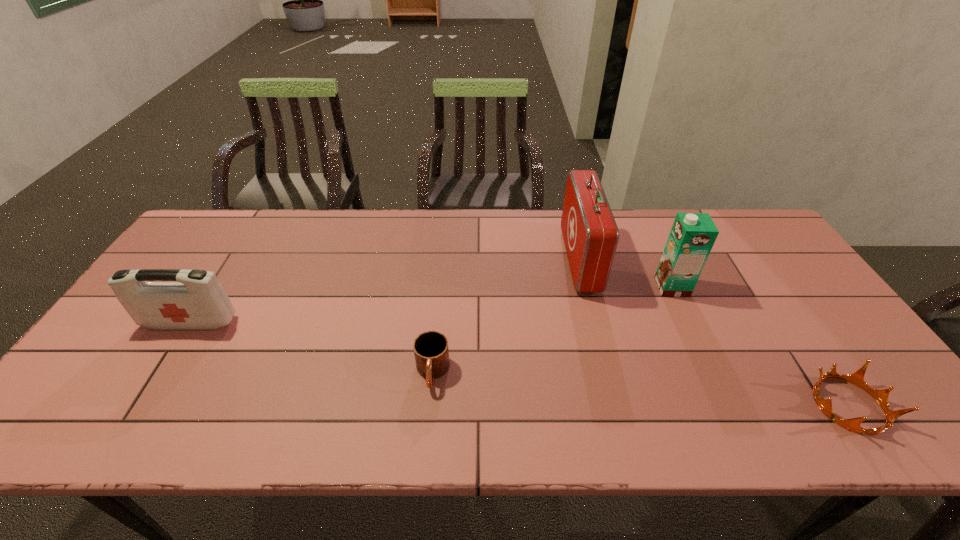
You are a GUI agent. You are given a task and a screenshot of the screen. Output one action in this format:
    pyautogui.click(x=<x>, y=<y>)
    Task: Click on the blank space at the near edge of the desktop
    
    Given the screenshot: What is the action you would take?
    pyautogui.click(x=498, y=415)

Image resolution: width=960 pixels, height=540 pixels. I want to click on vacant space at the right edge of the desktop, so click(x=735, y=261).

What are the coordinates of `free space at the far right corner` in the screenshot? It's located at (765, 241).

Identify the location of vacant region at the near right corner of the desktop. This screenshot has width=960, height=540. (856, 441).

Locate an element on the screen. vacant space that's between the mug and the right first-aid kit is located at coordinates (506, 316).

This screenshot has width=960, height=540. Identify the location of free space between the right first-aid kit and the mug. (506, 316).

You are a GUI agent. You are given a task and a screenshot of the screen. Output one action in this format:
    pyautogui.click(x=<x>, y=<y>)
    Task: Click on the free space between the third object from right to left and the second object from right to left
    This screenshot has height=540, width=960.
    Given the screenshot: What is the action you would take?
    pyautogui.click(x=626, y=273)

At what (x,y) coordinates should I click in order to perform the action: click on blank region between the rightmost object and the second object from right to left. Please return your answer as a coordinate pair (x, y). The width and height of the screenshot is (960, 540). Looking at the image, I should click on (760, 346).

Locate an element on the screen. free space between the taller first-aid kit and the mug is located at coordinates (506, 316).

I want to click on vacant area that lies between the mug and the rightmost object, so click(640, 389).